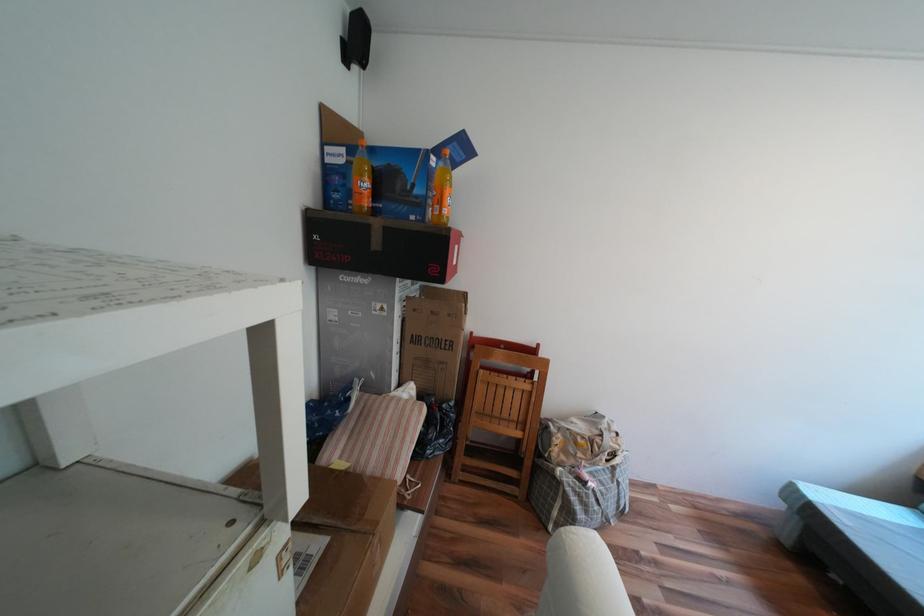
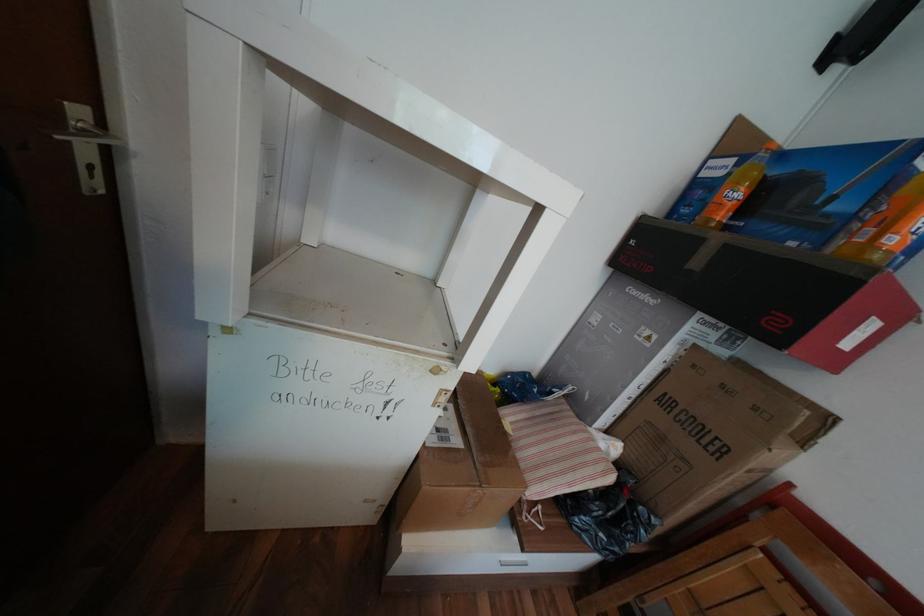
Question: How did the camera likely rotate?

Choices:
 (A) Left
 (B) Right
 (C) Up
 (D) Down

Answer: (A)